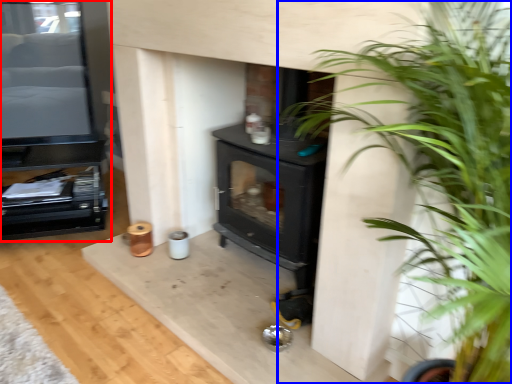
Question: Which point is further to the camera, entertainment center (highlighted by a red box) or houseplant (highlighted by a blue box)?

Choices:
 (A) entertainment center
 (B) houseplant

Answer: (A)